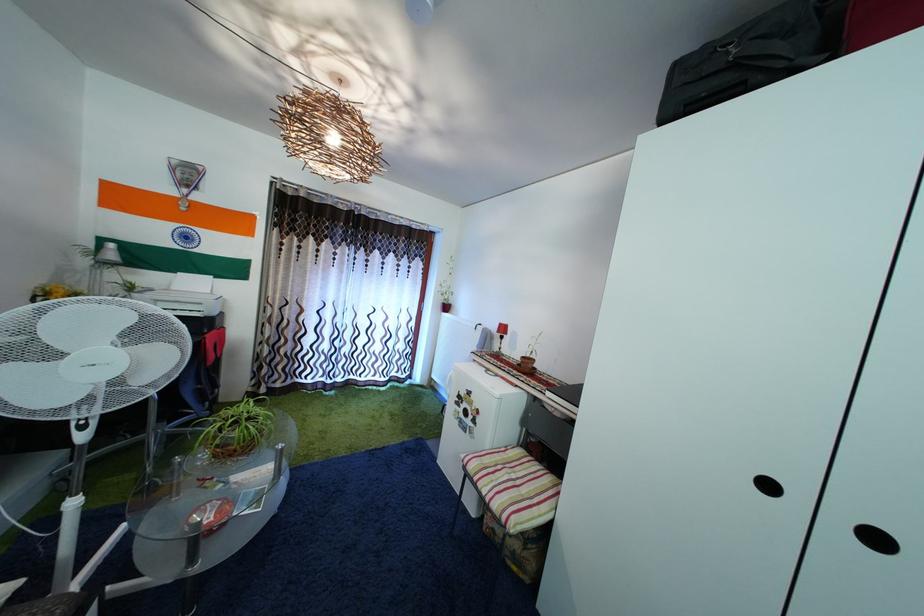
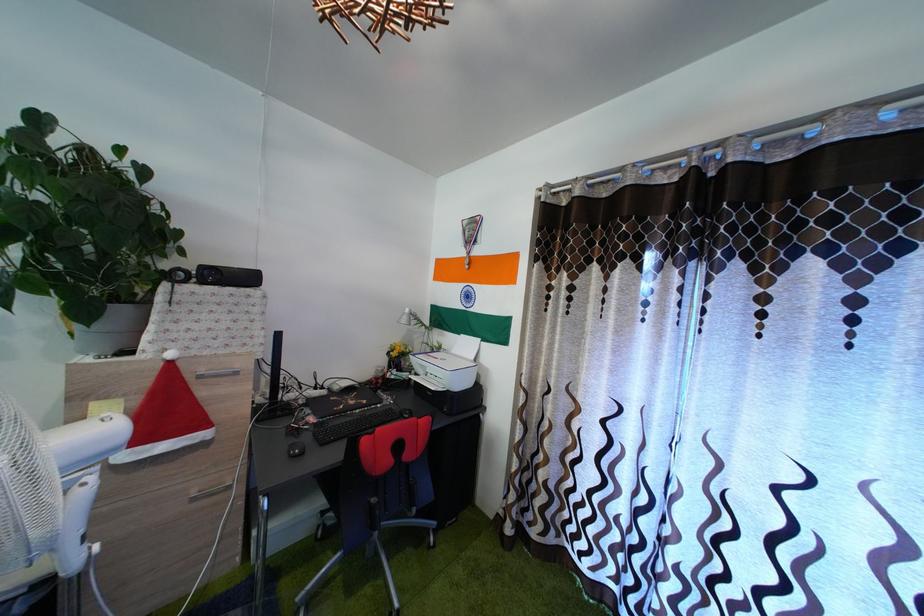
Locate, in the second image, the point that corresponds to the point at 184,296 in the first image.

(462, 359)